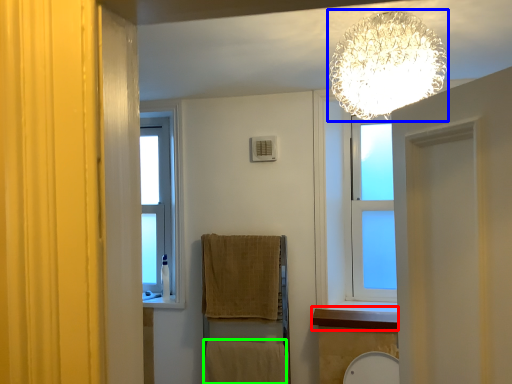
Question: Which object is positioned farthest from window sill (highlighted by a red box)? Select from lamp (highlighted by a blue box) and bath towel (highlighted by a green box).

Choices:
 (A) lamp
 (B) bath towel

Answer: (A)